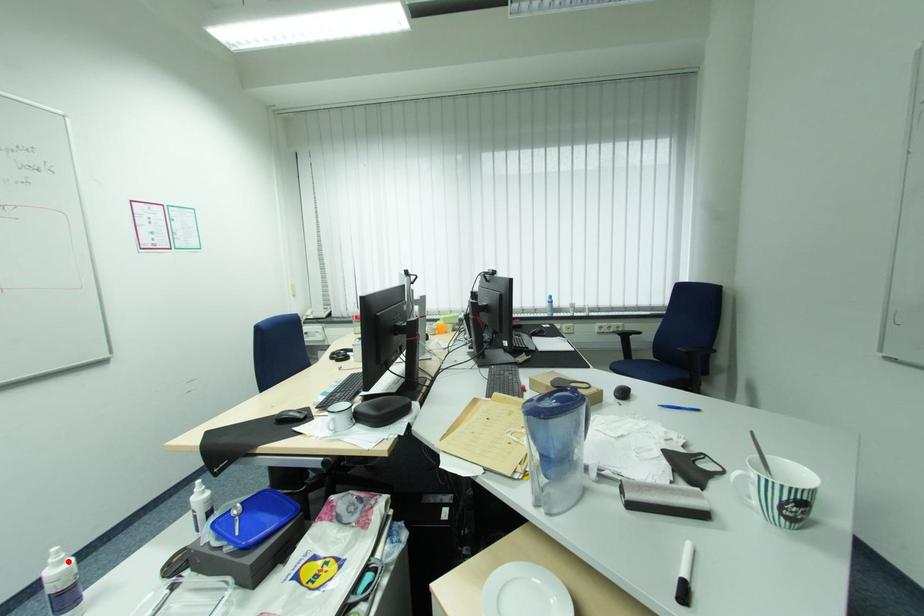
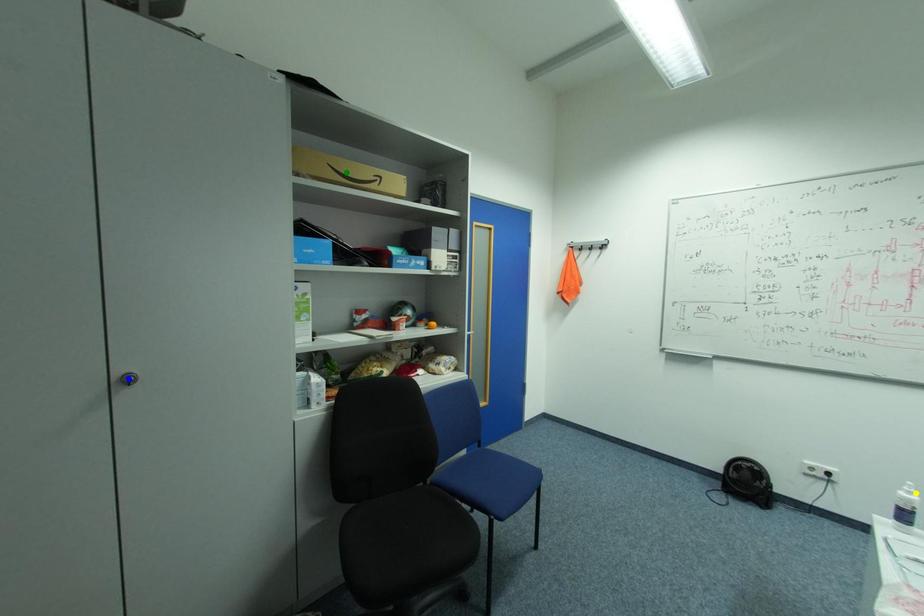
Question: I am providing you with two images of the same scene from different viewpoints. A red point is marked on the first image. You are given multiple points on the second image. Which point in image 2 represents the same 3d spot as the red point in image 1?

Choices:
 (A) yellow point
 (B) blue point
 (C) green point

Answer: (A)